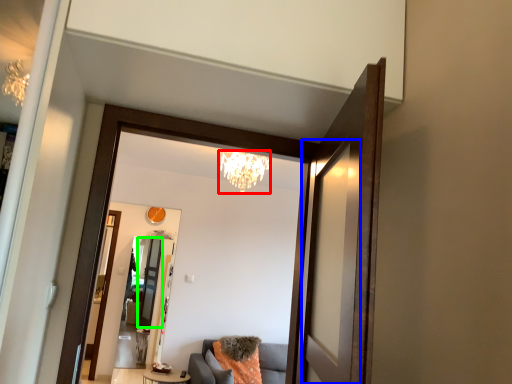
Question: Which is nearer to the light fixture (highlighted by a red box)? screen door (highlighted by a blue box) or screen door (highlighted by a green box).

Choices:
 (A) screen door
 (B) screen door

Answer: (B)